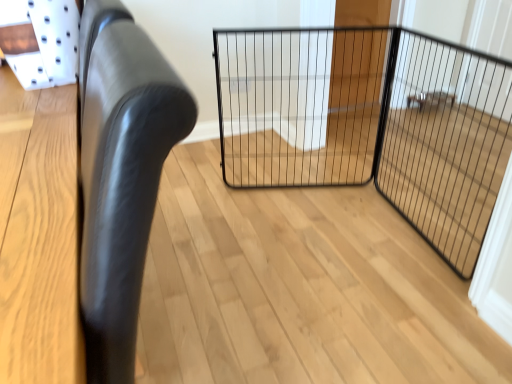
This screenshot has height=384, width=512. I want to click on vacant space positioned to the left of black wire mesh screen door at center, so click(x=335, y=238).